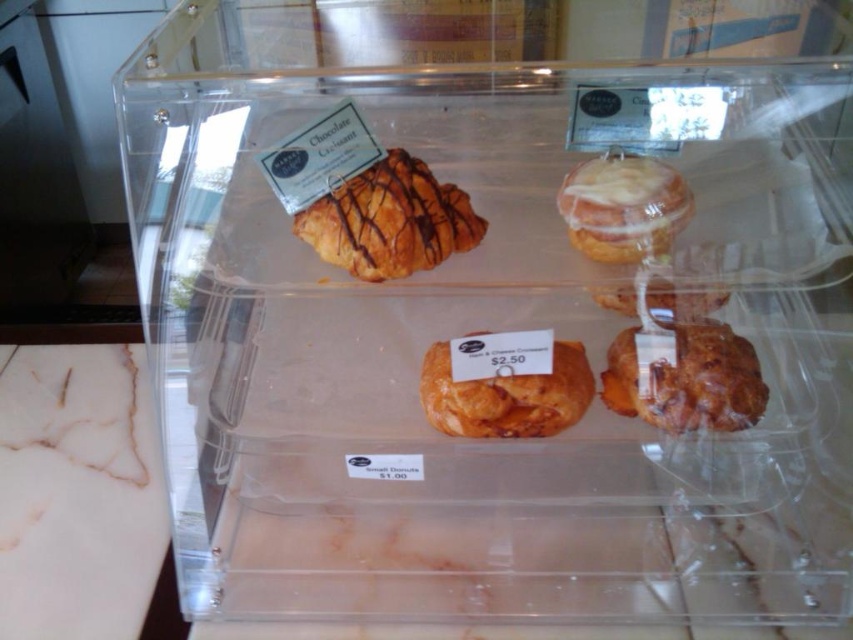
You are a customer at a bakery trying to grab two pastries from the display case. The golden flaky croissant at center and the white glazed donut at upper center are both on your list. Given that your hands can only reach 4 inches apart, can you comfortably pick both items at the same time?

The golden flaky croissant at center and white glazed donut at upper center are 4.09 inches apart from each other. Since your hands can only reach 4 inches apart, you cannot comfortably pick both items at the same time as the distance exceeds your reach.

You are a customer looking at the display case. There are two points marked in the image. Point A is at coordinates point (326, 216) and Point B is at coordinates point (604, 160). Which point is closer to you?

Point A at coordinates point (326, 216) is closer to you because it is further to the viewer than point (604, 160).